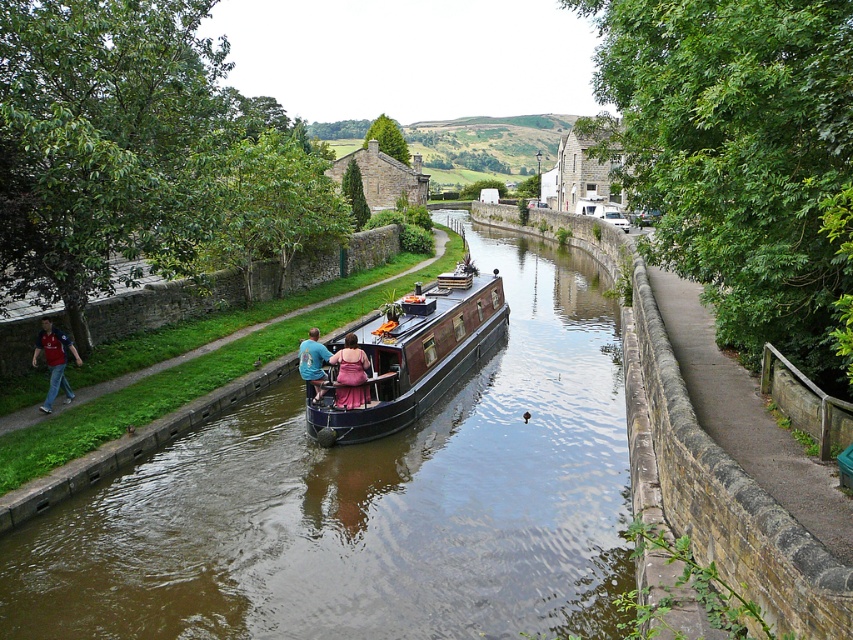
Is stone paved path at right shorter than blue cotton shirt at center?

No.

Is stone paved path at right positioned at the back of blue cotton shirt at center?

No, stone paved path at right is closer to the viewer.

Between point (738, 492) and point (305, 372), which one is positioned in front?

Point (738, 492) is more forward.

Identify the location of stone paved path at right. (732, 502).

Is point (671, 371) positioned after point (42, 324)?

No, (671, 371) is closer to viewer.

Who is lower down, stone paved path at right or matte red shirt at left?

Positioned lower is matte red shirt at left.

Who is more forward, (659, 336) or (50, 376)?

Point (659, 336)

Locate an element on the screen. stone paved path at right is located at coordinates (732, 502).

Does stone paved path at right appear under rustic wood boat at center?

Yes.

Who is positioned more to the right, stone paved path at right or rustic wood boat at center?

stone paved path at right is more to the right.

Is point (666, 515) in front of point (422, 392)?

Yes, it is in front of point (422, 392).

The image size is (853, 640). I want to click on stone paved path at right, so click(x=732, y=502).